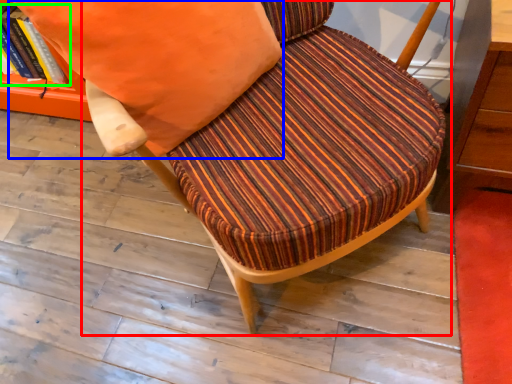
Question: Estimate the real-world distances between objects in this image. Which object is farther from chair (highlighted by a red box), throw pillow (highlighted by a blue box) or book (highlighted by a green box)?

Choices:
 (A) throw pillow
 (B) book

Answer: (B)